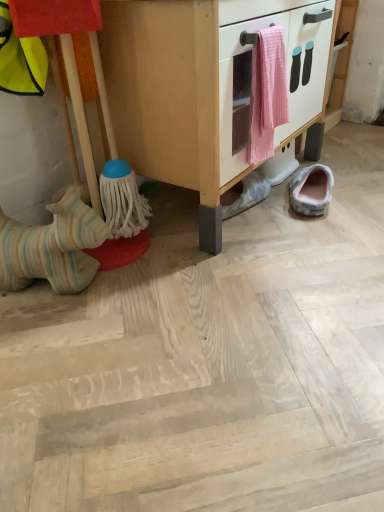
Question: Should I look upward or downward to see striped fabric toy at lower left, the first footwear viewed from the left?

Choices:
 (A) down
 (B) up

Answer: (B)

Question: Is striped fabric horse at left positioned behind light pink fabric slipper at lower right, the first footwear positioned from the right?

Choices:
 (A) no
 (B) yes

Answer: (A)

Question: Does striped fabric horse at left have a larger size compared to light pink fabric slipper at lower right, positioned as the 3th footwear in left-to-right order?

Choices:
 (A) yes
 (B) no

Answer: (A)

Question: Does striped fabric horse at left have a greater width compared to light pink fabric slipper at lower right, positioned as the 3th footwear in left-to-right order?

Choices:
 (A) no
 (B) yes

Answer: (B)

Question: Is striped fabric horse at left turned away from light pink fabric slipper at lower right, the first footwear positioned from the right?

Choices:
 (A) yes
 (B) no

Answer: (B)

Question: Would you say striped fabric horse at left is a long distance from light pink fabric slipper at lower right, positioned as the 3th footwear in left-to-right order?

Choices:
 (A) yes
 (B) no

Answer: (B)

Question: Is striped fabric horse at left at the right side of light pink fabric slipper at lower right, the first footwear positioned from the right?

Choices:
 (A) yes
 (B) no

Answer: (B)

Question: From the image's perspective, does pink woven towel at center appear lower than light pink fabric slipper at lower right, positioned as the 3th footwear in left-to-right order?

Choices:
 (A) yes
 (B) no

Answer: (B)

Question: From the image's perspective, does pink woven towel at center appear higher than light pink fabric slipper at lower right, positioned as the 3th footwear in left-to-right order?

Choices:
 (A) no
 (B) yes

Answer: (B)

Question: Does pink woven towel at center have a larger size compared to light pink fabric slipper at lower right, positioned as the 3th footwear in left-to-right order?

Choices:
 (A) no
 (B) yes

Answer: (B)

Question: Does pink woven towel at center have a smaller size compared to light pink fabric slipper at lower right, the first footwear positioned from the right?

Choices:
 (A) yes
 (B) no

Answer: (B)

Question: Would you say light pink fabric slipper at lower right, positioned as the 3th footwear in left-to-right order, is part of pink woven towel at center's contents?

Choices:
 (A) yes
 (B) no

Answer: (B)

Question: Does pink woven towel at center lie behind light pink fabric slipper at lower right, the first footwear positioned from the right?

Choices:
 (A) no
 (B) yes

Answer: (A)

Question: Is light pink fabric slipper at lower right, positioned as the 3th footwear in left-to-right order, oriented away from striped fabric horse at left?

Choices:
 (A) no
 (B) yes

Answer: (A)